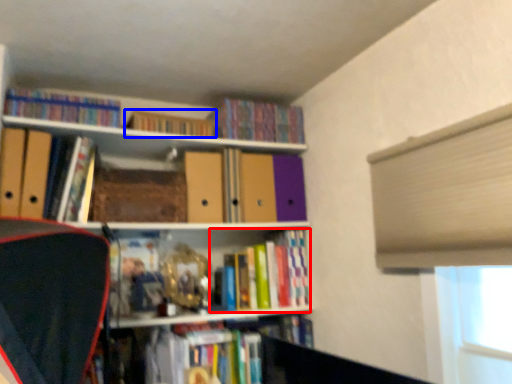
Question: Which object is further to the camera taking this photo, book (highlighted by a red box) or book (highlighted by a blue box)?

Choices:
 (A) book
 (B) book

Answer: (A)